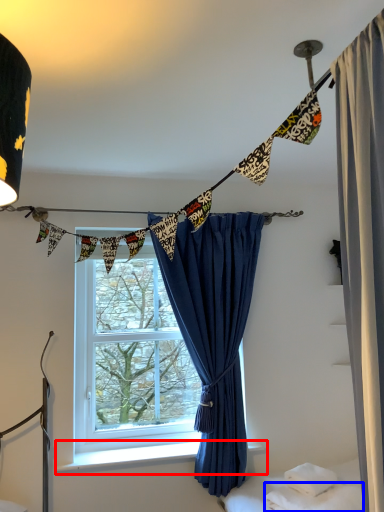
Question: Which object is further to the camera taking this photo, window sill (highlighted by a red box) or sheet (highlighted by a blue box)?

Choices:
 (A) window sill
 (B) sheet

Answer: (A)